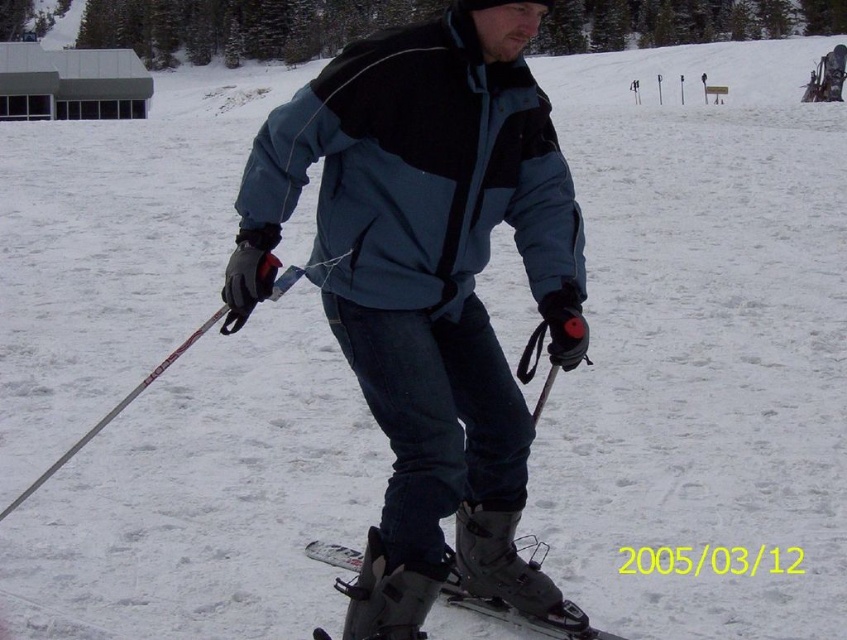
You are a photographer trying to capture the skier in the image. You want to ensure the matte blue ski jacket at center and the white plastic ski pole at left are both in the frame. Based on their positions, which object should you focus on first to include both in the shot?

The matte blue ski jacket at center is below the white plastic ski pole at left, so focusing on the lower area where the jacket is located first would ensure both objects are included in the frame.

You are a ski equipment inspector checking the gear of a skier. You notice the matte black ski at center and the white plastic ski pole at left. Based on their widths, which one is more suitable for a beginner skier?

The matte black ski at center might be wider than white plastic ski pole at left, so it is more suitable for a beginner skier because wider skis provide better stability on snow.

You are a drone operator trying to capture a photo of the matte blue ski jacket at center. The drone is currently at point A located at coordinates 0.3, 0.3. To get the best shot, you need to adjust the drone to the jacket position. In which direction should you move the drone horizontally to reach the jacket?

The matte blue ski jacket at center is located at point (428, 284). Since the drone is at (253, 192), you should move the drone to the right and upwards to reach the jacket.